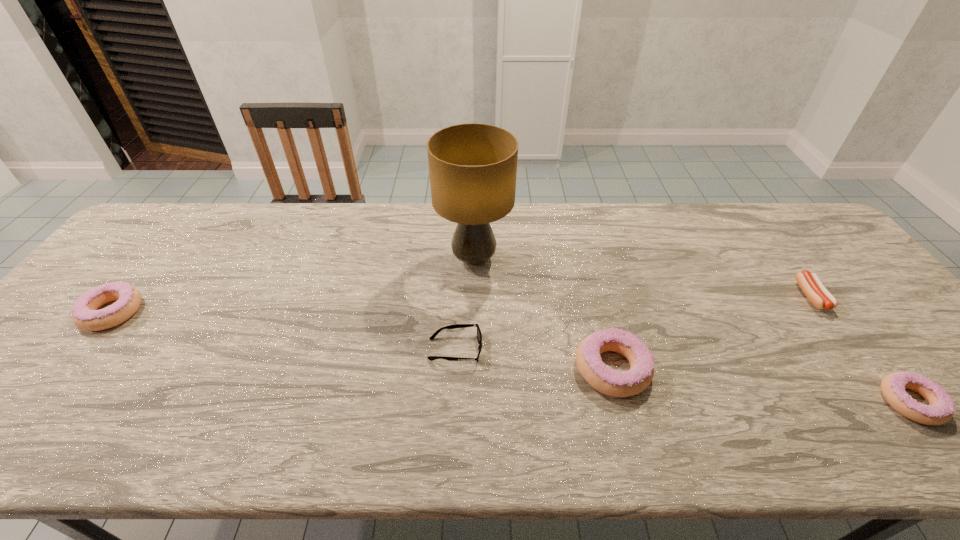
Where is `vacant region located on the front-facing side of the sunglasses`? Image resolution: width=960 pixels, height=540 pixels. vacant region located on the front-facing side of the sunglasses is located at coordinates (568, 349).

This screenshot has height=540, width=960. I want to click on object that is positioned at the far edge, so click(473, 167).

The image size is (960, 540). Find the location of `object that is at the near edge`. object that is at the near edge is located at coordinates coord(601,377).

At what (x,y) coordinates should I click in order to perform the action: click on object present at the left edge. Please return your answer as a coordinate pair (x, y). The image size is (960, 540). Looking at the image, I should click on (85, 315).

I want to click on object positioned at the right edge, so click(x=811, y=285).

Identify the location of free spot at the far edge of the desktop. click(636, 226).

Identify the location of vacant region at the left edge of the desktop. point(147,279).

Where is `free space at the right edge of the desktop`? The height and width of the screenshot is (540, 960). free space at the right edge of the desktop is located at coordinates (870, 310).

In the image, there is a desktop. At what (x,y) coordinates should I click in order to perform the action: click on blank space at the far left corner. Please return your answer as a coordinate pair (x, y). Image resolution: width=960 pixels, height=540 pixels. Looking at the image, I should click on (192, 218).

Locate an element on the screen. vacant region at the far right corner is located at coordinates (783, 212).